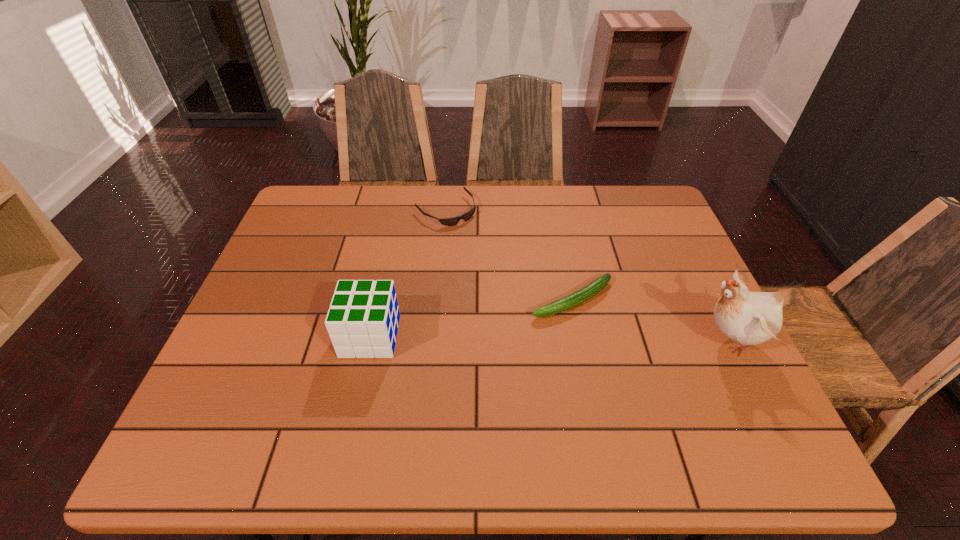
You are a GUI agent. You are given a task and a screenshot of the screen. Output one action in this format:
    pyautogui.click(x=<x>, y=<y>)
    Task: Click on the blank space that satisfies the following two spatial constraints: 1. on the front side of the zucchini; 2. on the left side of the shortest object
    
    Given the screenshot: What is the action you would take?
    pyautogui.click(x=438, y=299)

Locate an element on the screen. The width and height of the screenshot is (960, 540). vacant area in the image that satisfies the following two spatial constraints: 1. on the front side of the rightmost object; 2. at the beak of the zucchini is located at coordinates (580, 340).